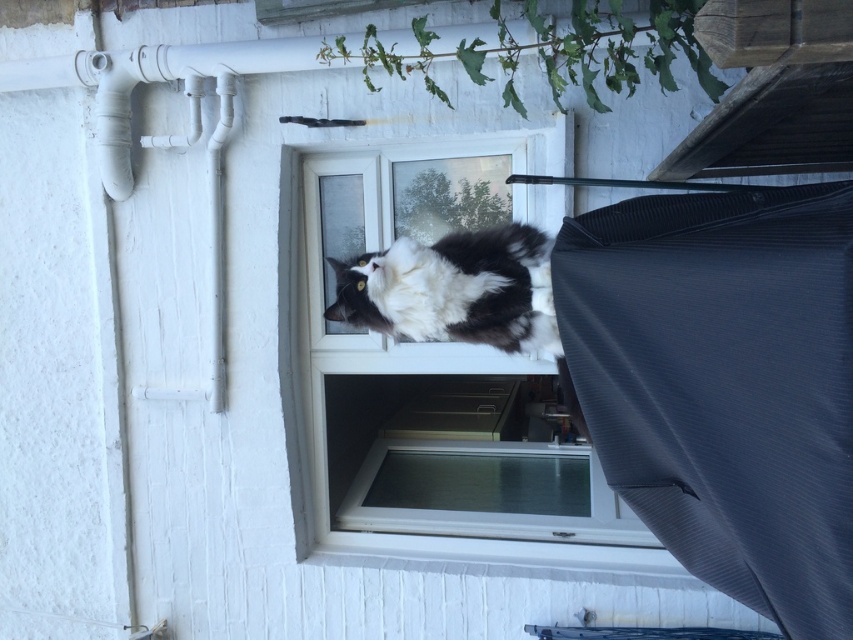
Question: Which point is closer to the camera?

Choices:
 (A) (396, 236)
 (B) (508, 246)
 (C) (672, 264)

Answer: (C)

Question: Is dark grey textured fabric at right to the right of clear glass window at center from the viewer's perspective?

Choices:
 (A) yes
 (B) no

Answer: (A)

Question: Can you confirm if dark grey textured fabric at right is wider than clear glass window at center?

Choices:
 (A) yes
 (B) no

Answer: (B)

Question: Which of these objects is positioned closest to the white painted wood at lower center?

Choices:
 (A) clear glass window at center
 (B) black and white fur cat at center

Answer: (A)

Question: Can you confirm if clear glass window at center is bigger than white painted wood at lower center?

Choices:
 (A) no
 (B) yes

Answer: (B)

Question: Which of the following is the closest to the observer?

Choices:
 (A) white painted wood at lower center
 (B) clear glass window at center

Answer: (B)